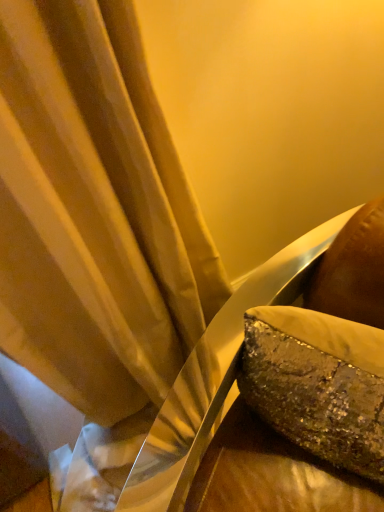
Question: Should I look upward or downward to see shiny metallic bag at right?

Choices:
 (A) down
 (B) up

Answer: (A)